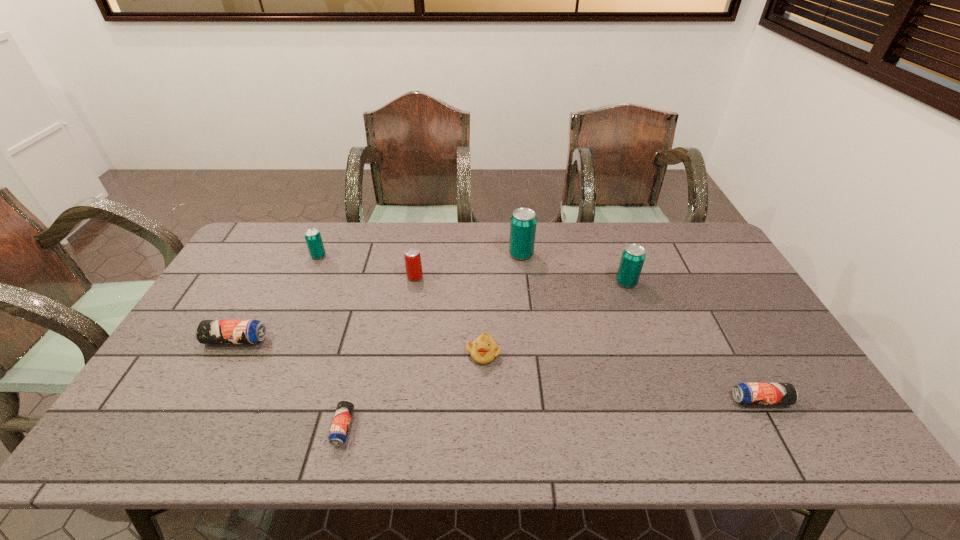
You are a GUI agent. You are given a task and a screenshot of the screen. Output one action in this format:
    pyautogui.click(x=<x>, y=<y>)
    Task: Click on the farthest blue beer can
    The height and width of the screenshot is (540, 960).
    Given the screenshot: What is the action you would take?
    pyautogui.click(x=208, y=331)

You are a GUI agent. You are given a task and a screenshot of the screen. Output one action in this format:
    pyautogui.click(x=<x>, y=<y>)
    Task: Click on the leftmost blue beer can
    Image resolution: width=960 pixels, height=540 pixels.
    Given the screenshot: What is the action you would take?
    pyautogui.click(x=208, y=331)

What are the coordinates of `the rightmost beer can` in the screenshot? It's located at (745, 393).

I want to click on the rightmost blue beer can, so click(x=745, y=393).

Identify the location of the shortest beer can. This screenshot has width=960, height=540. (339, 429).

The image size is (960, 540). In order to click on the second blue beer can from left to right in this screenshot , I will do `click(339, 429)`.

Locate an element on the screen. vacant space situated 0.110m on the back of the tallest object is located at coordinates click(518, 229).

Where is `vacant space situated 0.110m on the right of the second object from right to left`? vacant space situated 0.110m on the right of the second object from right to left is located at coordinates (671, 282).

The height and width of the screenshot is (540, 960). I want to click on vacant position located on the right of the fifth object from right to left, so click(500, 277).

Identify the location of free space located on the right of the sixth beer can from right to left. This screenshot has width=960, height=540. (411, 256).